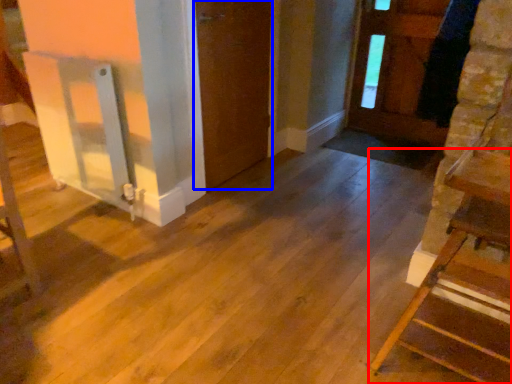
Question: Among these objects, which one is nearest to the camera, furniture (highlighted by a red box) or door (highlighted by a blue box)?

Choices:
 (A) furniture
 (B) door

Answer: (A)